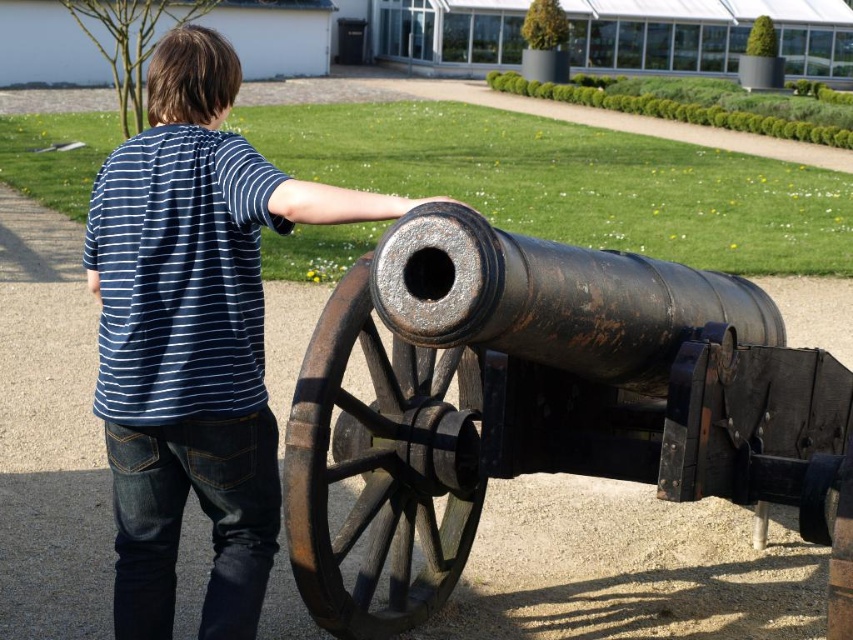
Question: Which of the following is the closest to the observer?

Choices:
 (A) (270, 184)
 (B) (160, 630)

Answer: (A)

Question: Does rusty metal cannon at center come in front of blue striped shirt at center?

Choices:
 (A) yes
 (B) no

Answer: (A)

Question: Estimate the real-world distances between objects in this image. Which object is farther from the blue striped t-shirt at upper left?

Choices:
 (A) blue striped shirt at center
 (B) rusty metal cannon at center

Answer: (B)

Question: Can you confirm if blue striped shirt at center is smaller than blue striped t-shirt at upper left?

Choices:
 (A) no
 (B) yes

Answer: (A)

Question: Among these points, which one is farthest from the camera?

Choices:
 (A) (711, 474)
 (B) (195, 445)

Answer: (A)

Question: Is rusty metal cannon at center to the right of blue striped shirt at center from the viewer's perspective?

Choices:
 (A) no
 (B) yes

Answer: (B)